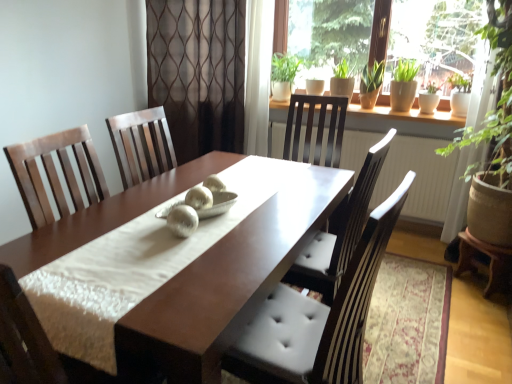
Question: Is white glossy radiator at upper center beside brown sheer curtain at center?

Choices:
 (A) no
 (B) yes

Answer: (A)

Question: Does white glossy radiator at upper center have a lesser width compared to brown sheer curtain at center?

Choices:
 (A) no
 (B) yes

Answer: (B)

Question: Are white glossy radiator at upper center and brown sheer curtain at center located far from each other?

Choices:
 (A) no
 (B) yes

Answer: (B)

Question: Does white glossy radiator at upper center have a greater height compared to brown sheer curtain at center?

Choices:
 (A) yes
 (B) no

Answer: (B)

Question: Can you confirm if white glossy radiator at upper center is shorter than brown sheer curtain at center?

Choices:
 (A) yes
 (B) no

Answer: (A)

Question: Is point (435, 165) positioned closer to the camera than point (500, 117)?

Choices:
 (A) farther
 (B) closer

Answer: (A)

Question: Relative to green leafy plant at right, is white glossy radiator at upper center in front or behind?

Choices:
 (A) behind
 (B) front

Answer: (A)

Question: From the image's perspective, is white glossy radiator at upper center located above or below green leafy plant at right?

Choices:
 (A) below
 (B) above

Answer: (A)

Question: From a real-world perspective, is white glossy radiator at upper center physically located above or below green leafy plant at right?

Choices:
 (A) above
 (B) below

Answer: (B)

Question: Considering the positions of shiny brown table at center, acting as the second table starting from the right, and brown sheer curtain at center in the image, is shiny brown table at center, acting as the second table starting from the right, wider or thinner than brown sheer curtain at center?

Choices:
 (A) thin
 (B) wide

Answer: (B)

Question: Is point (205, 284) closer or farther from the camera than point (237, 99)?

Choices:
 (A) farther
 (B) closer

Answer: (B)

Question: Would you say shiny brown table at center, positioned as the 1th table in left-to-right order, is inside or outside brown sheer curtain at center?

Choices:
 (A) inside
 (B) outside

Answer: (B)

Question: From a real-world perspective, is shiny brown table at center, positioned as the 1th table in left-to-right order, physically located above or below brown sheer curtain at center?

Choices:
 (A) below
 (B) above

Answer: (A)

Question: From the image's perspective, is green leafy plant at right above or below matte brown chair at center?

Choices:
 (A) below
 (B) above

Answer: (B)

Question: Visually, is green leafy plant at right positioned to the left or to the right of matte brown chair at center?

Choices:
 (A) left
 (B) right

Answer: (B)